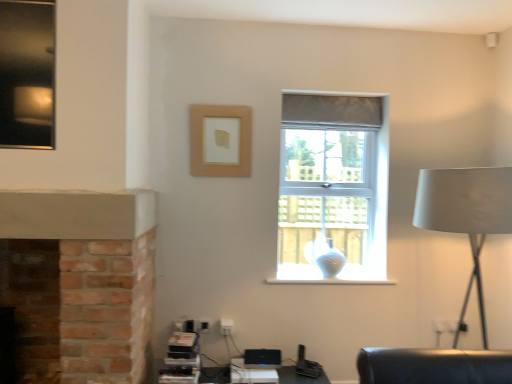
Question: From the image's perspective, is translucent glass vase at window on clear glass window at center?

Choices:
 (A) yes
 (B) no

Answer: (B)

Question: From a real-world perspective, is translucent glass vase at window below clear glass window at center?

Choices:
 (A) yes
 (B) no

Answer: (A)

Question: Considering the relative sizes of translucent glass vase at window and clear glass window at center in the image provided, is translucent glass vase at window shorter than clear glass window at center?

Choices:
 (A) no
 (B) yes

Answer: (B)

Question: Considering the relative sizes of translucent glass vase at window and clear glass window at center in the image provided, is translucent glass vase at window thinner than clear glass window at center?

Choices:
 (A) yes
 (B) no

Answer: (A)

Question: Considering the relative positions of translucent glass vase at window and clear glass window at center in the image provided, is translucent glass vase at window behind clear glass window at center?

Choices:
 (A) yes
 (B) no

Answer: (A)

Question: Would you say beige matte picture frame at upper center is inside or outside clear glass window at center?

Choices:
 (A) inside
 (B) outside

Answer: (B)

Question: Is beige matte picture frame at upper center wider or thinner than clear glass window at center?

Choices:
 (A) thin
 (B) wide

Answer: (A)

Question: Considering the relative positions of beige matte picture frame at upper center and clear glass window at center in the image provided, is beige matte picture frame at upper center to the left or to the right of clear glass window at center?

Choices:
 (A) left
 (B) right

Answer: (A)

Question: In the image, is beige matte picture frame at upper center positioned in front of or behind clear glass window at center?

Choices:
 (A) behind
 (B) front

Answer: (B)

Question: From a real-world perspective, is white plastic table at lower center above or below beige matte picture frame at upper center?

Choices:
 (A) above
 (B) below

Answer: (B)

Question: Relative to beige matte picture frame at upper center, is white plastic table at lower center in front or behind?

Choices:
 (A) front
 (B) behind

Answer: (A)

Question: Is white plastic table at lower center bigger or smaller than beige matte picture frame at upper center?

Choices:
 (A) big
 (B) small

Answer: (A)

Question: In terms of width, does white plastic table at lower center look wider or thinner when compared to beige matte picture frame at upper center?

Choices:
 (A) thin
 (B) wide

Answer: (B)

Question: Is point (321, 256) closer or farther from the camera than point (285, 367)?

Choices:
 (A) closer
 (B) farther

Answer: (B)

Question: From a real-world perspective, is translucent glass vase at window physically located above or below white plastic table at lower center?

Choices:
 (A) below
 (B) above

Answer: (B)